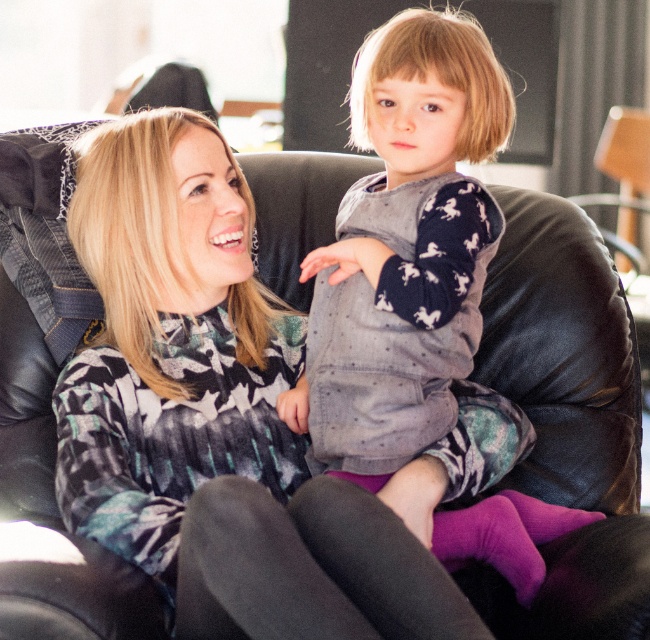
Does knit sweater at center have a lesser width compared to purple matte leggings at center?

In fact, knit sweater at center might be wider than purple matte leggings at center.

Does knit sweater at center appear on the right side of purple matte leggings at center?

Indeed, knit sweater at center is positioned on the right side of purple matte leggings at center.

Is point (447, 296) behind point (432, 564)?

Yes, it is.

Locate an element on the screen. knit sweater at center is located at coordinates (408, 260).